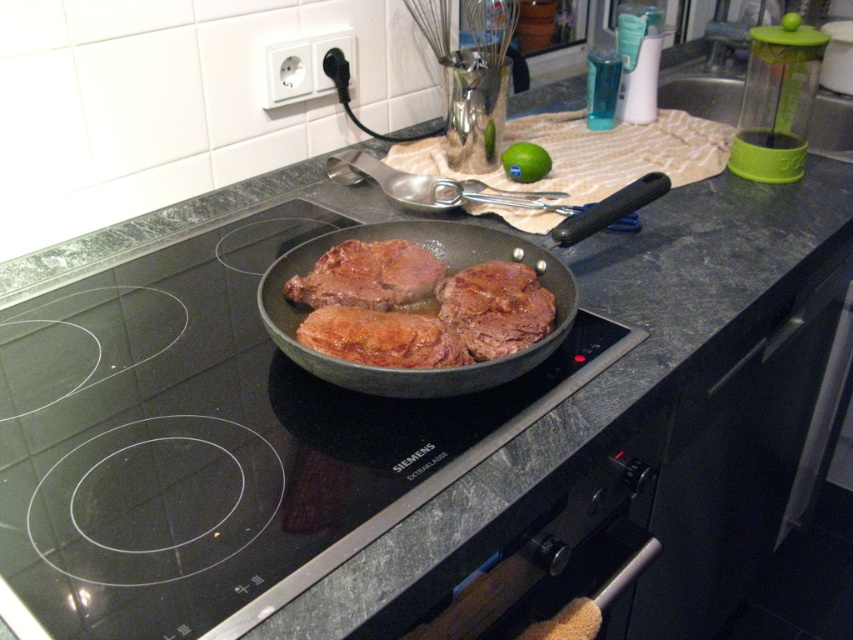
You are a chef standing in front of the stovetop. You need to reach the point at coordinates point (473,392) to adjust the heat. Your arm can extend 24 inches. Can you reach it without moving your body?

The distance of point (473,392) from camera is 26.47 inches. Since your arm can only extend 24 inches, you cannot reach it without moving your body.

You are a chef standing in front of the shiny black frying pan at center. You need to reach into the pan to flip the meat. Considering your arm length is 24 inches, will you be able to comfortably reach the pan?

The shiny black frying pan at center is 24.65 inches from viewer. Since your arm length is 24 inches, you will not be able to comfortably reach the pan as it is slightly farther than your arm can extend.

You are a chef trying to locate the shiny black frying pan at center in the kitchen. According to the image, where exactly is it positioned?

The shiny black frying pan at center is located at the point with coordinates 0.423 in the x axis and 0.529 in the y axis.